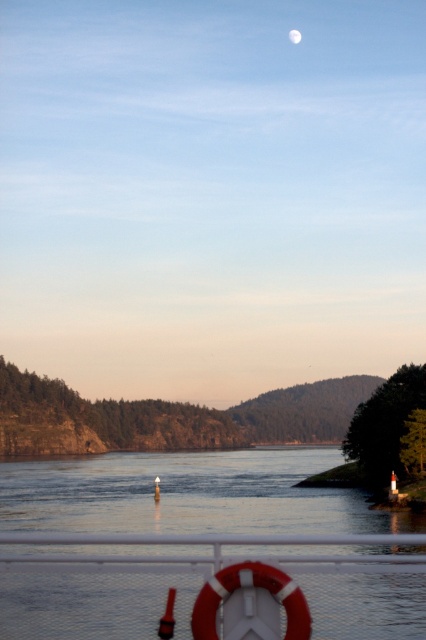
Who is lower down, white plastic lifebuoy at lower center or silvery reflective moon at upper center?

white plastic lifebuoy at lower center

Does white plastic lifebuoy at lower center come in front of silvery reflective moon at upper center?

Yes, it is.

You are a GUI agent. You are given a task and a screenshot of the screen. Output one action in this format:
    pyautogui.click(x=<x>, y=<y>)
    Task: Click on the white plastic lifebuoy at lower center
    Image resolution: width=426 pixels, height=640 pixels.
    Given the screenshot: What is the action you would take?
    pyautogui.click(x=212, y=586)

Locate an element on the screen. The height and width of the screenshot is (640, 426). white plastic lifebuoy at lower center is located at coordinates (212, 586).